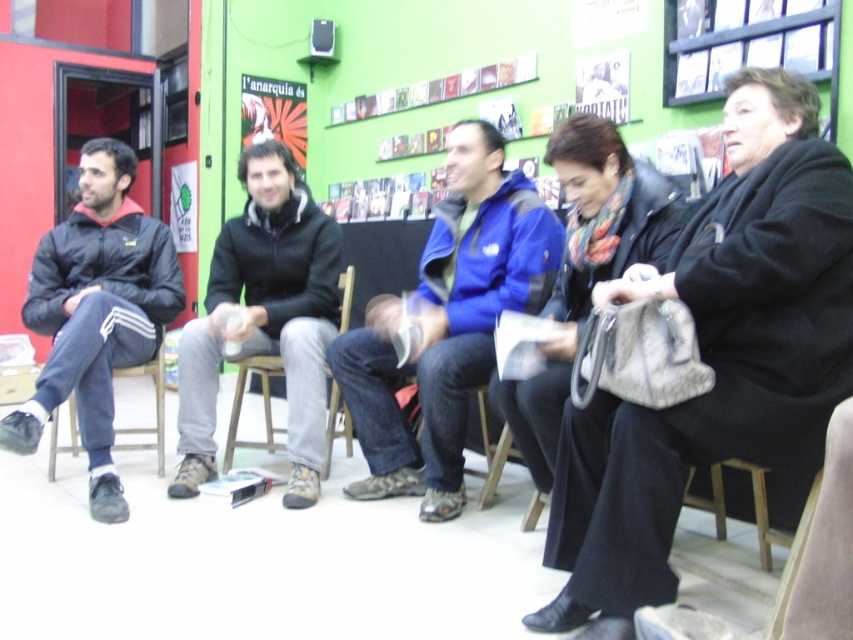
Question: Which is farther from the dark gray wool coat at center?

Choices:
 (A) dark gray fleece jacket at center
 (B) matte black jacket at left
 (C) blue fleece jacket at center

Answer: (B)

Question: Which of these objects is positioned farthest from the wooden stool at left?

Choices:
 (A) matte black jacket at left
 (B) wooden chair at center
 (C) dark gray wool coat at center
 (D) blue fleece jacket at center

Answer: (C)

Question: Is wooden chair at center smaller than wooden stool at left?

Choices:
 (A) no
 (B) yes

Answer: (A)

Question: Observing the image, what is the correct spatial positioning of dark gray wool coat at center in reference to matte black jacket at left?

Choices:
 (A) below
 (B) above

Answer: (A)

Question: Is dark gray wool coat at center above blue fleece jacket at center?

Choices:
 (A) no
 (B) yes

Answer: (A)

Question: Estimate the real-world distances between objects in this image. Which object is farther from the matte black jacket at left?

Choices:
 (A) wooden chair at center
 (B) wooden stool at left
 (C) blue fleece jacket at center
 (D) dark gray fleece jacket at center

Answer: (C)